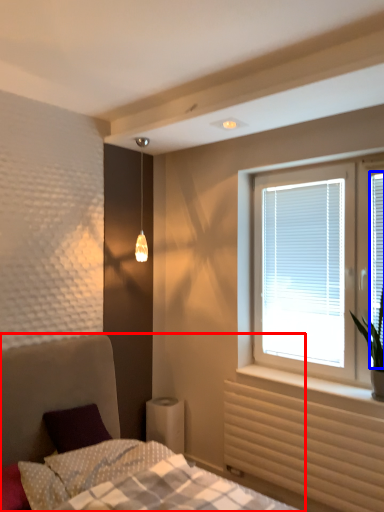
Question: Which of the following is the farthest to the observer, bed (highlighted by a red box) or window screen (highlighted by a blue box)?

Choices:
 (A) bed
 (B) window screen

Answer: (B)